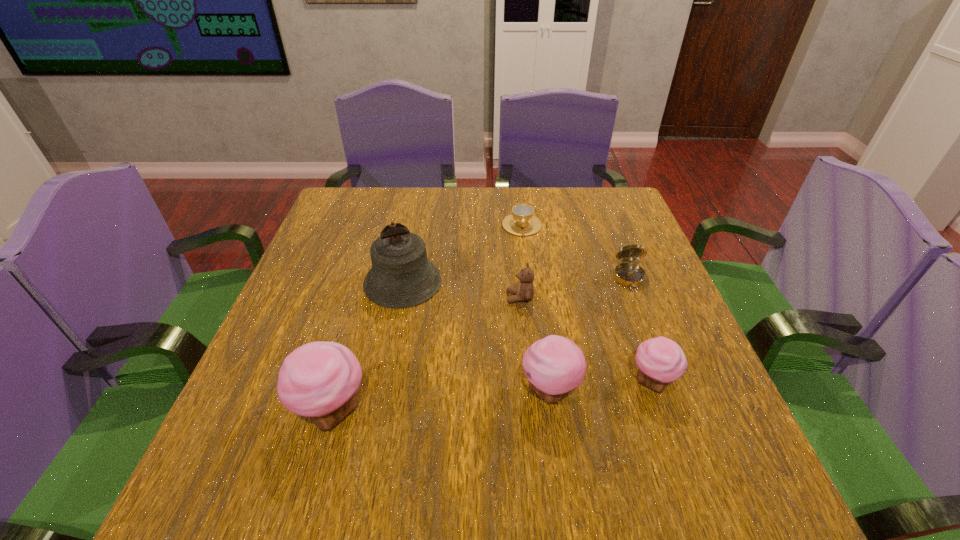
This screenshot has height=540, width=960. Identify the location of free space that is in between the teddy bear and the second tallest object. (426, 354).

The height and width of the screenshot is (540, 960). I want to click on unoccupied area between the rightmost cupcake and the second tallest cupcake, so click(x=601, y=387).

Where is `empty space that is in between the tallest cupcake and the teddy bear`? The image size is (960, 540). empty space that is in between the tallest cupcake and the teddy bear is located at coordinates tap(426, 354).

Find the location of a particular element. This screenshot has width=960, height=540. vacant area that lies between the rightmost cupcake and the tallest cupcake is located at coordinates coord(492,396).

The height and width of the screenshot is (540, 960). Find the location of `free area in between the shortest cupcake and the shortest object`. free area in between the shortest cupcake and the shortest object is located at coordinates (587, 303).

The image size is (960, 540). Identify the location of unoccupied area between the shortest cupcake and the shortest object. (587, 303).

The height and width of the screenshot is (540, 960). I want to click on vacant area that lies between the bell and the compass, so click(x=516, y=280).

This screenshot has width=960, height=540. Identify the location of free space that is in between the bell and the rightmost cupcake. (527, 332).

You are a GUI agent. You are given a task and a screenshot of the screen. Output one action in this format:
    pyautogui.click(x=<x>, y=<y>)
    Task: Click on the fourth closest object relative to the bell
    
    Given the screenshot: What is the action you would take?
    pyautogui.click(x=555, y=365)

At what (x,y) coordinates should I click in order to perform the action: click on object that is the second closest to the second cupcake from left to right. Please return your answer as a coordinate pair (x, y). Looking at the image, I should click on (524, 291).